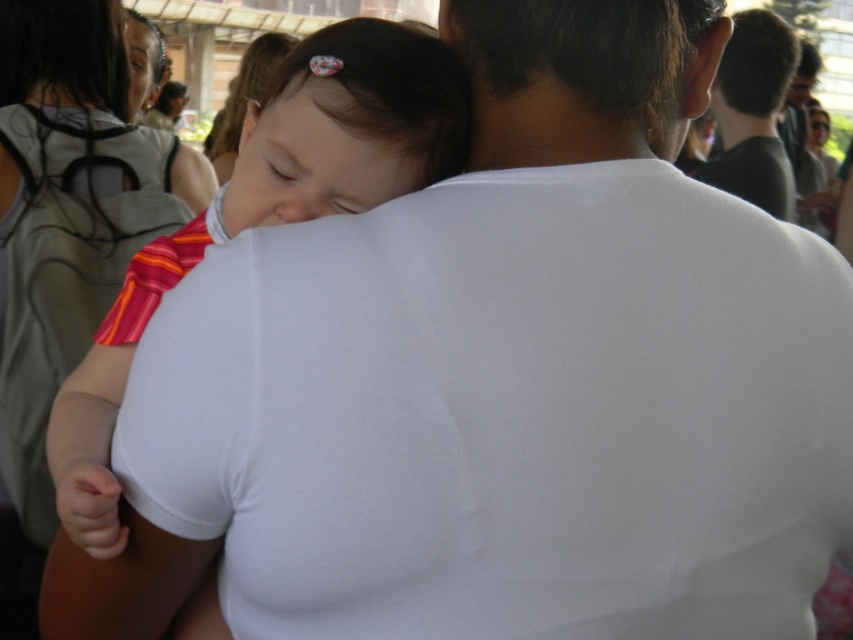
Question: Can you confirm if black matte hair at upper right is thinner than smooth brown hair at upper left?

Choices:
 (A) no
 (B) yes

Answer: (B)

Question: Is black matte hair at upper right thinner than dark gray shirt at upper right?

Choices:
 (A) no
 (B) yes

Answer: (A)

Question: Which object is closer to the camera taking this photo?

Choices:
 (A) matte black hair at upper left
 (B) matte white shirt at center
 (C) matte white tank top at upper left
 (D) black matte hair at upper right

Answer: (B)

Question: Does dark gray shirt at upper right appear under smooth brown hair at upper left?

Choices:
 (A) yes
 (B) no

Answer: (A)

Question: Which point is farther from the camera taking this photo?

Choices:
 (A) (340, 182)
 (B) (148, 104)
 (C) (782, 138)
 (D) (0, 68)

Answer: (C)

Question: Which object is farther from the camera taking this photo?

Choices:
 (A) matte black hair at upper left
 (B) matte white shirt at center
 (C) matte white tank top at upper left
 (D) black matte hair at upper right

Answer: (D)